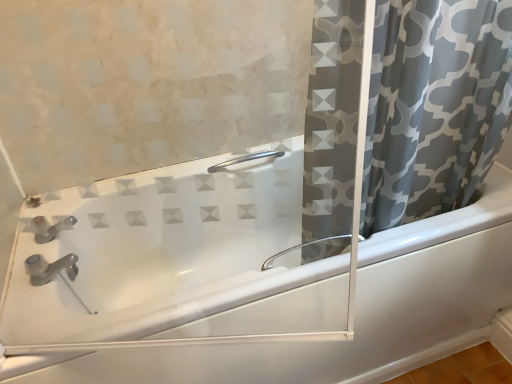
Question: Looking at their shapes, would you say white glossy bathtub at center is wider or thinner than satin nickel faucet at upper left?

Choices:
 (A) wide
 (B) thin

Answer: (A)

Question: From the image's perspective, is white glossy bathtub at center above or below satin nickel faucet at upper left?

Choices:
 (A) above
 (B) below

Answer: (B)

Question: Considering the real-world distances, which object is closest to the satin nickel faucet at upper left?

Choices:
 (A) gray printed fabric curtain at right
 (B) satin nickel grab bar at upper center
 (C) white glossy bathtub at center

Answer: (C)

Question: Considering the real-world distances, which object is closest to the satin nickel faucet at upper left?

Choices:
 (A) white glossy bathtub at center
 (B) satin nickel grab bar at upper center
 (C) gray printed fabric curtain at right

Answer: (A)